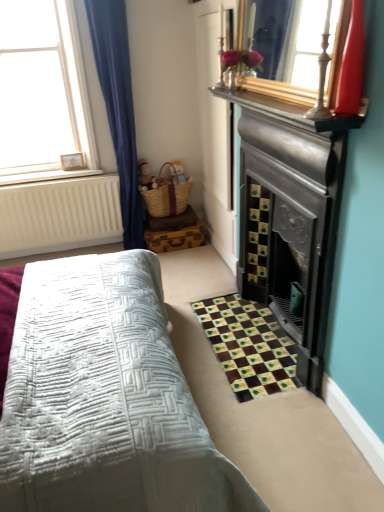
Measure the distance between point (194, 302) and camera.

Point (194, 302) and camera are 2.89 meters apart.

The height and width of the screenshot is (512, 384). What do you see at coordinates (248, 345) in the screenshot?
I see `brown fabric rug at lower right` at bounding box center [248, 345].

Describe the element at coordinates (42, 93) in the screenshot. I see `white wooden frame at upper left` at that location.

Find the location of a particular element. brown fabric rug at lower right is located at coordinates (248, 345).

In the image, is brown fabric rug at lower right on the left side or the right side of wooden picture frame at upper left?

brown fabric rug at lower right is to the right of wooden picture frame at upper left.

Is brown fabric rug at lower right not near wooden picture frame at upper left?

Yes, brown fabric rug at lower right and wooden picture frame at upper left are quite far apart.

Which object is further away from the camera, brown fabric rug at lower right or wooden picture frame at upper left?

wooden picture frame at upper left is further from the camera.

Is shiny red glass vase at upper right far from wooden picture frame at upper left?

Indeed, shiny red glass vase at upper right is not near wooden picture frame at upper left.

Is shiny red glass vase at upper right positioned with its back to wooden picture frame at upper left?

shiny red glass vase at upper right does not have its back to wooden picture frame at upper left.

Does point (345, 109) lie in front of point (64, 158)?

Yes, it is in front of point (64, 158).

Is shiny red glass vase at upper right inside the boundaries of wooden picture frame at upper left, or outside?

shiny red glass vase at upper right is located beyond the bounds of wooden picture frame at upper left.

From the image's perspective, which object appears higher, white wooden frame at upper left or shiny red glass vase at upper right?

white wooden frame at upper left, from the image's perspective.

Is white wooden frame at upper left at the right side of shiny red glass vase at upper right?

Incorrect, white wooden frame at upper left is not on the right side of shiny red glass vase at upper right.

Is white wooden frame at upper left in front of or behind shiny red glass vase at upper right in the image?

white wooden frame at upper left is positioned farther from the viewer than shiny red glass vase at upper right.

How far apart are white wooden frame at upper left and shiny red glass vase at upper right?

white wooden frame at upper left and shiny red glass vase at upper right are 8.19 feet apart from each other.

Considering the sizes of objects wooden picture frame at upper left and white wooden frame at upper left in the image provided, who is smaller, wooden picture frame at upper left or white wooden frame at upper left?

wooden picture frame at upper left.

I want to click on window above the wooden picture frame at upper left (from a real-world perspective), so click(x=42, y=93).

Is wooden picture frame at upper left not near white wooden frame at upper left?

They are positioned close to each other.

Is wooden picture frame at upper left far away from brown fabric rug at lower right?

wooden picture frame at upper left is far away from brown fabric rug at lower right.

Is wooden picture frame at upper left turned away from brown fabric rug at lower right?

No.

Which of these two, wooden picture frame at upper left or brown fabric rug at lower right, is bigger?

brown fabric rug at lower right.

From the image's perspective, does wooden picture frame at upper left appear higher than brown fabric rug at lower right?

Indeed, from the image's perspective, wooden picture frame at upper left is shown above brown fabric rug at lower right.

Considering the sizes of objects shiny red glass vase at upper right and brown fabric rug at lower right in the image provided, who is smaller, shiny red glass vase at upper right or brown fabric rug at lower right?

shiny red glass vase at upper right.

From the image's perspective, which object appears higher, shiny red glass vase at upper right or brown fabric rug at lower right?

shiny red glass vase at upper right appears higher in the image.

Considering the relative sizes of shiny red glass vase at upper right and brown fabric rug at lower right in the image provided, is shiny red glass vase at upper right thinner than brown fabric rug at lower right?

Yes, shiny red glass vase at upper right is thinner than brown fabric rug at lower right.

You are a GUI agent. You are given a task and a screenshot of the screen. Output one action in this format:
    pyautogui.click(x=<x>, y=<y>)
    Task: Click on the pattern below the shiny red glass vase at upper right (from the image's perspective)
    This screenshot has height=512, width=384.
    Given the screenshot: What is the action you would take?
    pyautogui.click(x=248, y=345)

Which of these two, brown fabric rug at lower right or shiny red glass vase at upper right, is smaller?

shiny red glass vase at upper right.

From the image's perspective, is brown fabric rug at lower right positioned above or below shiny red glass vase at upper right?

From the image's perspective, brown fabric rug at lower right appears below shiny red glass vase at upper right.

Where is `pattern behind the shiny red glass vase at upper right`? This screenshot has width=384, height=512. pattern behind the shiny red glass vase at upper right is located at coordinates (248, 345).

Locate an element on the screen. The width and height of the screenshot is (384, 512). picture frame that appears above the brown fabric rug at lower right (from a real-world perspective) is located at coordinates (72, 161).

Where is `picture frame on the left of shiny red glass vase at upper right`? The height and width of the screenshot is (512, 384). picture frame on the left of shiny red glass vase at upper right is located at coordinates (72, 161).

Which object lies nearer to the anchor point brown fabric rug at lower right, wooden picture frame at upper left or shiny red glass vase at upper right?

shiny red glass vase at upper right lies closer to brown fabric rug at lower right than the other object.

Which object lies further to the anchor point shiny red glass vase at upper right, wooden picture frame at upper left or white wooden frame at upper left?

Among the two, wooden picture frame at upper left is located further to shiny red glass vase at upper right.

Looking at the image, which one is located further to wooden picture frame at upper left, white wooden frame at upper left or shiny red glass vase at upper right?

shiny red glass vase at upper right is positioned further to the anchor wooden picture frame at upper left.

From the image, which object appears to be farther from white wooden frame at upper left, shiny red glass vase at upper right or brown fabric rug at lower right?

Based on the image, shiny red glass vase at upper right appears to be further to white wooden frame at upper left.

Considering their positions, is white wooden frame at upper left positioned closer to shiny red glass vase at upper right than wooden picture frame at upper left?

white wooden frame at upper left is positioned closer to the anchor shiny red glass vase at upper right.

Which object lies nearer to the anchor point wooden picture frame at upper left, brown fabric rug at lower right or white wooden frame at upper left?

The object closer to wooden picture frame at upper left is white wooden frame at upper left.

When comparing their distances from shiny red glass vase at upper right, does brown fabric rug at lower right or white wooden frame at upper left seem further?

Among the two, white wooden frame at upper left is located further to shiny red glass vase at upper right.

Estimate the real-world distances between objects in this image. Which object is closer to shiny red glass vase at upper right, white wooden frame at upper left or brown fabric rug at lower right?

Based on the image, brown fabric rug at lower right appears to be nearer to shiny red glass vase at upper right.

Locate an element on the screen. The height and width of the screenshot is (512, 384). picture frame between white wooden frame at upper left and brown fabric rug at lower right in the up-down direction is located at coordinates (72, 161).

Locate an element on the screen. This screenshot has width=384, height=512. pattern between shiny red glass vase at upper right and wooden picture frame at upper left along the z-axis is located at coordinates (248, 345).

This screenshot has width=384, height=512. I want to click on window between shiny red glass vase at upper right and wooden picture frame at upper left in the front-back direction, so click(x=42, y=93).

Identify the location of pattern between white wooden frame at upper left and shiny red glass vase at upper right. (248, 345).